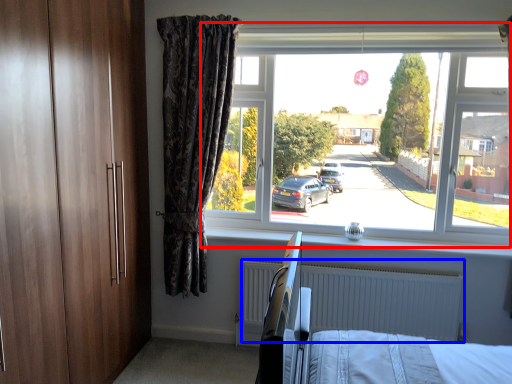
Question: Which point is closer to the camera, window (highlighted by a red box) or radiator (highlighted by a blue box)?

Choices:
 (A) window
 (B) radiator

Answer: (A)